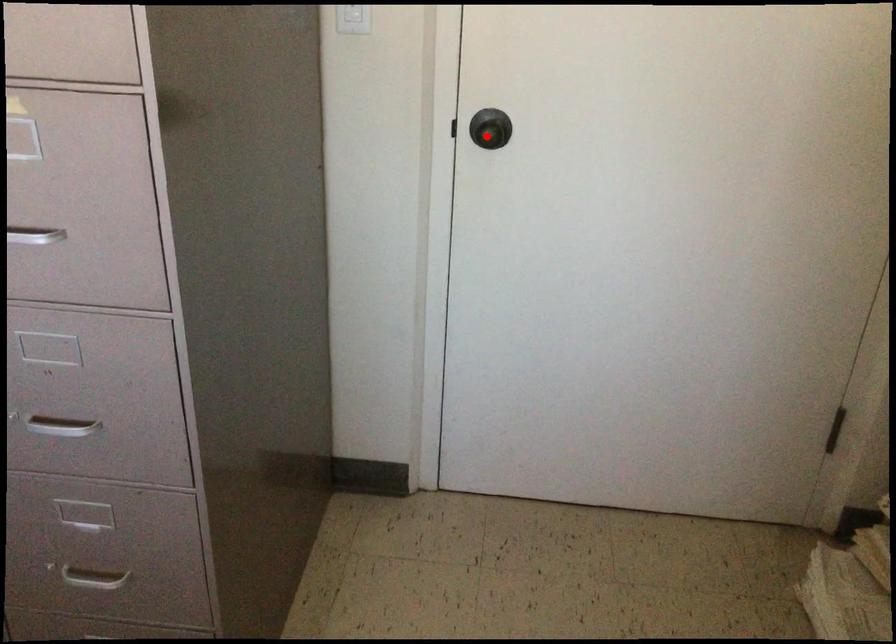
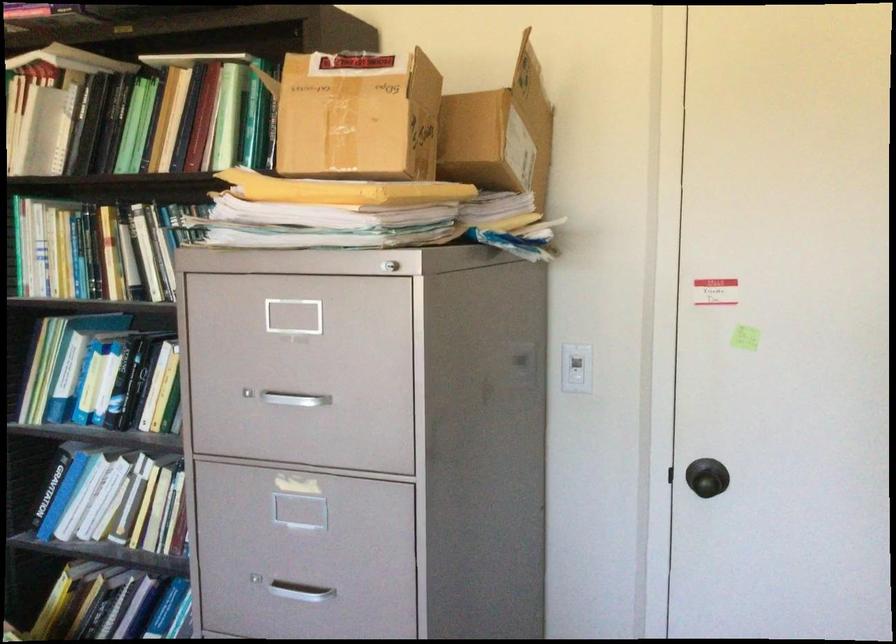
Locate, in the second image, the point that corresponds to the highlighted location in the first image.

(707, 482)